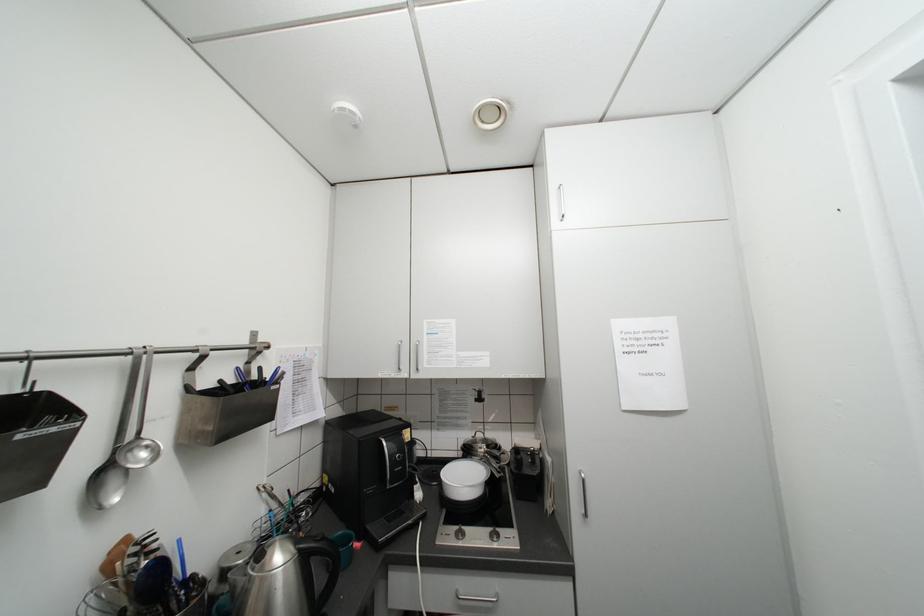
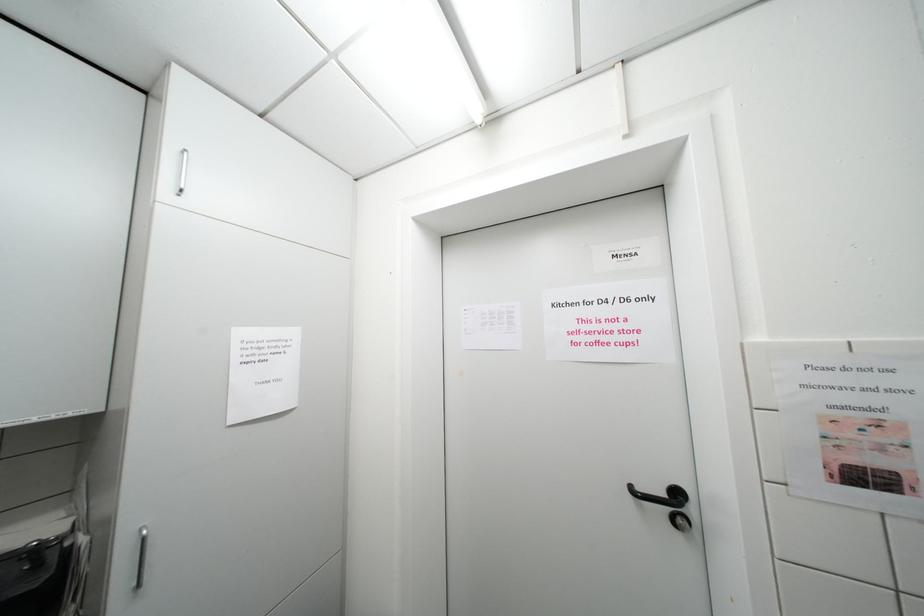
Question: The camera is either moving clockwise (left) or counter-clockwise (right) around the object. The first image is from the beginning of the video and the second image is from the end. Is the camera moving left or right when shooting the video?

Choices:
 (A) Left
 (B) Right

Answer: (A)